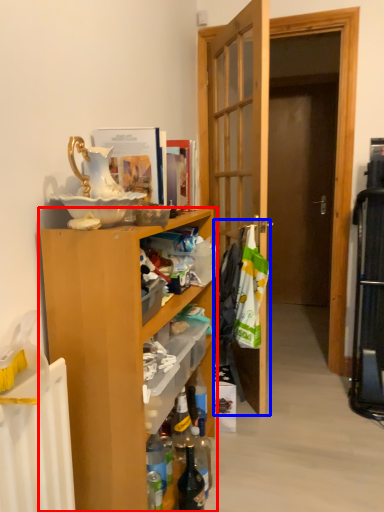
Question: Which of the following is the closest to the observer, cabinetry (highlighted by a red box) or laundry (highlighted by a blue box)?

Choices:
 (A) cabinetry
 (B) laundry

Answer: (A)